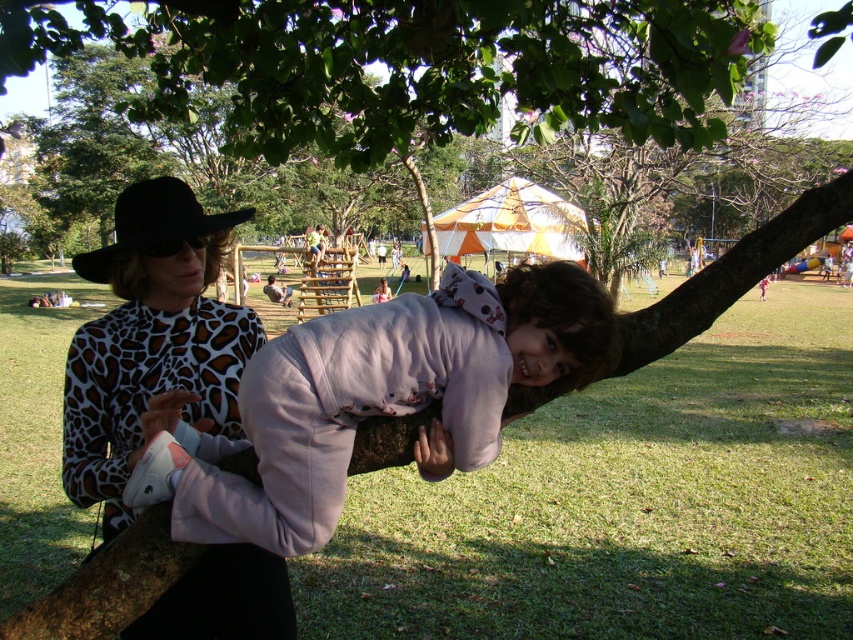
You are a photographer trying to capture the printed fabric sweater at center and the brown rough tree branch at center in the same frame. Based on their positions, will the sweater be visible in the photo if you focus on the tree branch?

The printed fabric sweater at center is located below the brown rough tree branch at center, so if you focus on the tree branch, the sweater will still be visible in the photo as it is positioned underneath.

You are a photographer trying to capture the pale pink fleece at center and printed fabric sweater at center in the same frame. Which one should you focus on first to ensure both are in focus?

The pale pink fleece at center is located below the printed fabric sweater at center, so you should focus on the printed fabric sweater at center first to ensure both are in focus.